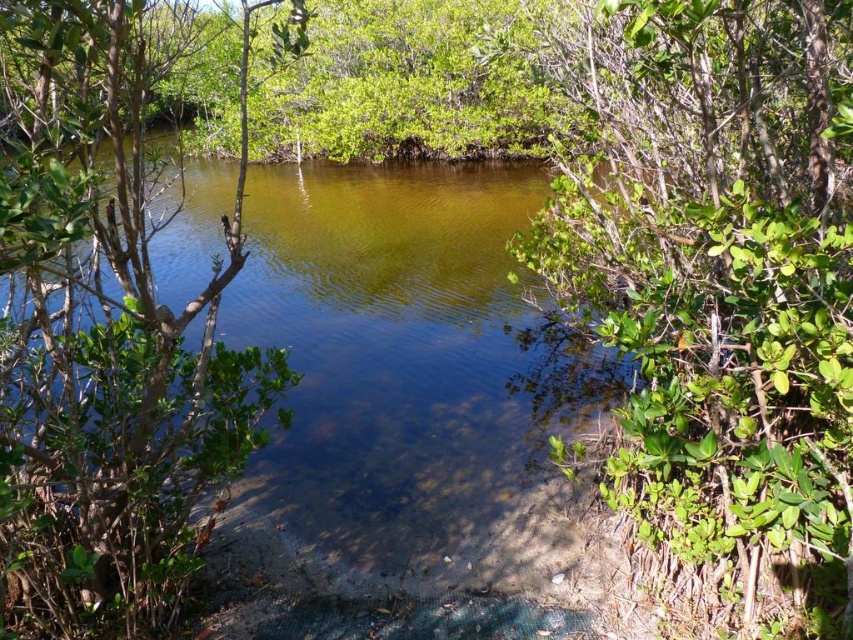
Question: Can you confirm if green leafy bush at center is bigger than clear water at center?

Choices:
 (A) no
 (B) yes

Answer: (A)

Question: Observing the image, what is the correct spatial positioning of clear water at center in reference to green leafy tree at left?

Choices:
 (A) below
 (B) above

Answer: (B)

Question: Can you confirm if clear water at center is positioned to the right of green leafy tree at left?

Choices:
 (A) no
 (B) yes

Answer: (B)

Question: Which is nearer to the clear water at center?

Choices:
 (A) green leafy bush at center
 (B) green leafy tree at left

Answer: (B)

Question: Which point is farther to the camera?

Choices:
 (A) (515, 420)
 (B) (624, 116)

Answer: (B)

Question: Among these points, which one is nearest to the camera?

Choices:
 (A) (426, 218)
 (B) (30, 145)

Answer: (B)